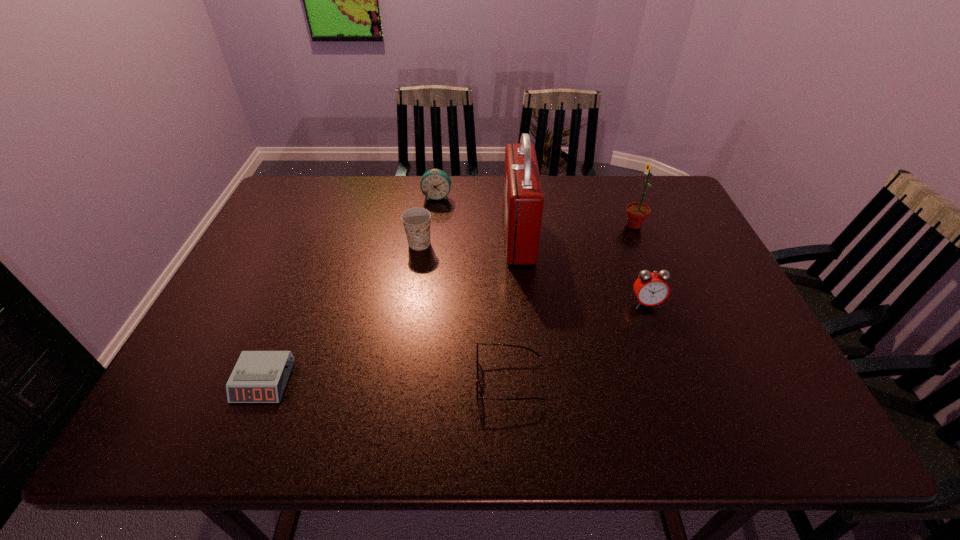
Locate an element on the screen. This screenshot has width=960, height=540. vacant position located on the front face of the tallest object is located at coordinates (428, 235).

Find the location of `free region located on the front face of the tallest object`. free region located on the front face of the tallest object is located at coordinates (373, 235).

Where is `free space located 0.170m on the front face of the tallest object`? The width and height of the screenshot is (960, 540). free space located 0.170m on the front face of the tallest object is located at coordinates (445, 235).

Where is `free space located 0.360m on the face of the sixth shortest object`? The height and width of the screenshot is (540, 960). free space located 0.360m on the face of the sixth shortest object is located at coordinates (501, 225).

Where is `free region located on the face of the sixth shortest object`? This screenshot has width=960, height=540. free region located on the face of the sixth shortest object is located at coordinates (535, 225).

Identify the location of vacant point located 0.130m on the face of the sixth shortest object. Image resolution: width=960 pixels, height=540 pixels. (579, 225).

You are a GUI agent. You are given a task and a screenshot of the screen. Output one action in this format:
    pyautogui.click(x=<x>, y=<y>)
    Task: Click on the vacant area situated on the front-facing side of the farthest alarm clock
    This screenshot has height=540, width=960.
    Given the screenshot: What is the action you would take?
    click(427, 276)

The image size is (960, 540). In order to click on vacant area situated 0.180m on the front-facing side of the second nearest alarm clock in this screenshot , I will do `click(672, 374)`.

At what (x,y) coordinates should I click in order to perform the action: click on vacant point located 0.100m on the front of the Dixie cup. Please return your answer as a coordinate pair (x, y). This screenshot has height=540, width=960. Looking at the image, I should click on pyautogui.click(x=414, y=278).

In order to click on vacant region located on the face of the spectacles in this screenshot , I will do `click(353, 380)`.